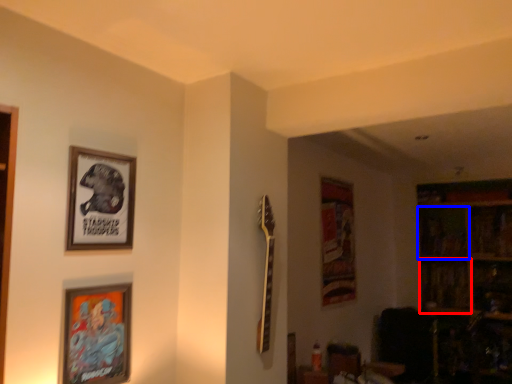
Question: Which of the following is the closest to the observer, shelf (highlighted by a red box) or shelf (highlighted by a blue box)?

Choices:
 (A) shelf
 (B) shelf

Answer: (A)